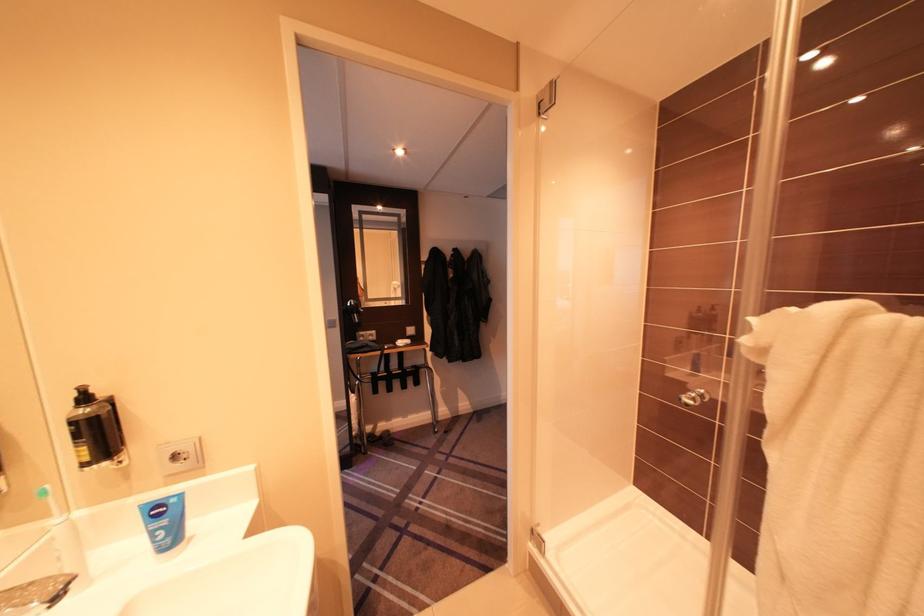
Which object does [164,522] point to?

It corresponds to the blue nivea tube in the image.